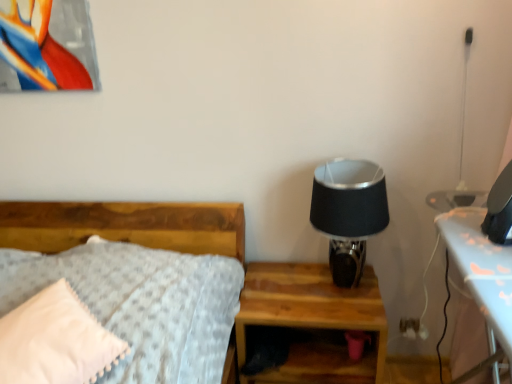
The width and height of the screenshot is (512, 384). I want to click on empty space that is ontop of wooden nightstand at lower right (from a real-world perspective), so click(306, 290).